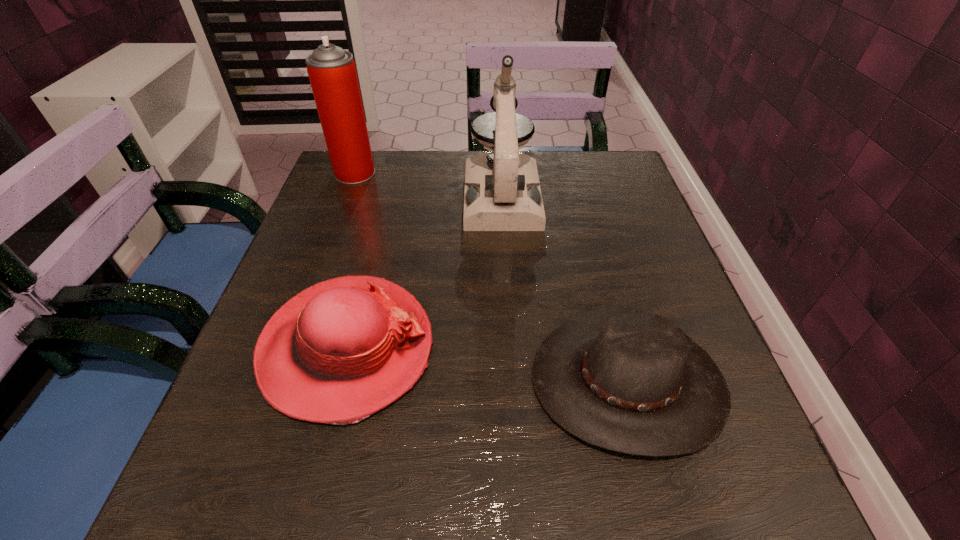
This screenshot has width=960, height=540. I want to click on free point between the aerosol can and the left hat, so click(x=351, y=260).

Image resolution: width=960 pixels, height=540 pixels. I want to click on empty space that is in between the right hat and the microscope, so click(564, 288).

Identify the location of free point between the left hat and the aerosol can. (351, 260).

Locate an element on the screen. Image resolution: width=960 pixels, height=540 pixels. vacant area that lies between the left hat and the microscope is located at coordinates (424, 272).

The height and width of the screenshot is (540, 960). I want to click on free space between the left hat and the aerosol can, so click(x=351, y=260).

I want to click on empty location between the left hat and the microscope, so click(x=424, y=272).

Where is `free spot between the microscope and the aerosol can`? The image size is (960, 540). free spot between the microscope and the aerosol can is located at coordinates (428, 185).

Locate an element on the screen. Image resolution: width=960 pixels, height=540 pixels. free space that is in between the left hat and the right hat is located at coordinates (488, 364).

Image resolution: width=960 pixels, height=540 pixels. In order to click on vacant area between the right hat and the aerosol can in this screenshot , I will do `click(492, 277)`.

Find the location of a particular element. empty location between the microscope and the right hat is located at coordinates (564, 288).